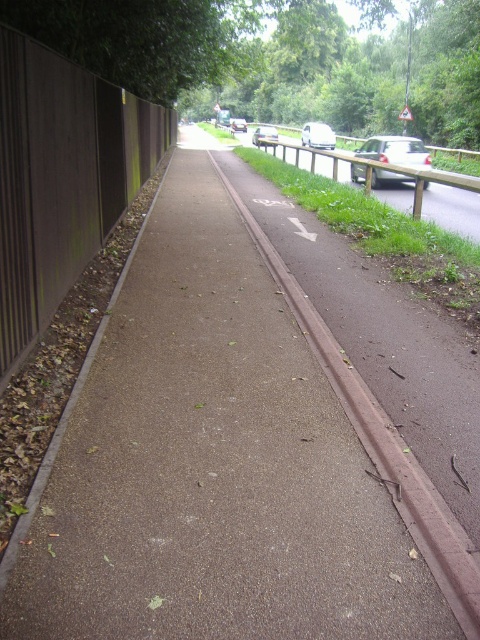
Question: Is white glossy van at center positioned behind silver metallic van at center?

Choices:
 (A) yes
 (B) no

Answer: (A)

Question: Among these points, which one is farthest from the camera?

Choices:
 (A) (411, 179)
 (B) (236, 129)

Answer: (B)

Question: Considering the real-world distances, which object is closest to the silver metallic car at center?

Choices:
 (A) metallic silver car at center
 (B) white glossy van at center
 (C) brown wooden fence at left

Answer: (C)

Question: Is brown wooden fence at left smaller than metallic silver car at center?

Choices:
 (A) no
 (B) yes

Answer: (B)

Question: Which point appears closest to the camera in this image?

Choices:
 (A) (240, 120)
 (B) (262, 141)

Answer: (B)

Question: Does silver metallic car at center have a larger size compared to silver metallic van at center?

Choices:
 (A) no
 (B) yes

Answer: (B)